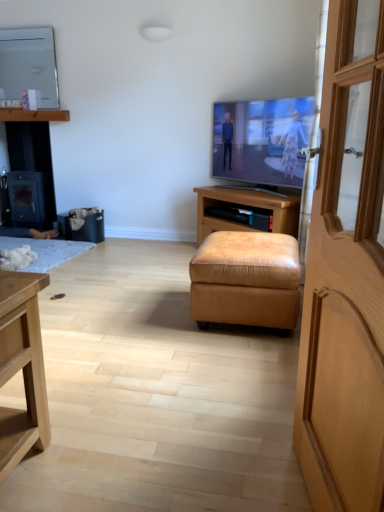
Locate an element on the screen. This screenshot has width=384, height=512. wooden door at right is located at coordinates (346, 275).

What is the approximate width of leather ottoman at center, which is counted as the second cabinetry, starting from the back?

It is 14.06 inches.

Describe the element at coordinates (30, 136) in the screenshot. I see `black matte wood fireplace at left` at that location.

Where is `black leather trash bin/can at lower left`? black leather trash bin/can at lower left is located at coordinates (82, 225).

In the image, there is a leather ottoman at center, acting as the 1th cabinetry starting from the right. Identify the location of plain below it (from the image's perspective). This screenshot has width=384, height=512. (46, 251).

Is white fluffy rug at lower left oriented away from leather ottoman at center, the 2th cabinetry when ordered from top to bottom?

No, white fluffy rug at lower left is not facing away from leather ottoman at center, the 2th cabinetry when ordered from top to bottom.

Is white fluffy rug at lower left with leather ottoman at center, positioned as the 1th cabinetry in front-to-back order?

They are not placed beside each other.

From a real-world perspective, does white fluffy rug at lower left sit lower than leather ottoman at center, placed as the second cabinetry when sorted from left to right?

Yes, from a real-world perspective, white fluffy rug at lower left is under leather ottoman at center, placed as the second cabinetry when sorted from left to right.

From the image's perspective, is flat screen tv at center, marked as the 2th television in a top-to-bottom arrangement, beneath white fluffy rug at lower left?

No, from the image's perspective, flat screen tv at center, marked as the 2th television in a top-to-bottom arrangement, is not beneath white fluffy rug at lower left.

Is white fluffy rug at lower left a part of flat screen tv at center, marked as the 2th television in a top-to-bottom arrangement?

No, white fluffy rug at lower left is not a part of flat screen tv at center, marked as the 2th television in a top-to-bottom arrangement.

Considering the positions of point (303, 127) and point (11, 241), is point (303, 127) closer or farther from the camera than point (11, 241)?

Point (303, 127) is positioned closer to the camera compared to point (11, 241).

Which object is positioned more to the right, flat screen tv at center, marked as the first television in a bottom-to-top arrangement, or tan leather ottoman at center?

flat screen tv at center, marked as the first television in a bottom-to-top arrangement, is more to the right.

How different are the orientations of flat screen tv at center, marked as the first television in a bottom-to-top arrangement, and tan leather ottoman at center in degrees?

48.8 degrees.

Who is smaller, flat screen tv at center, positioned as the 2th television in back-to-front order, or tan leather ottoman at center?

flat screen tv at center, positioned as the 2th television in back-to-front order.

Where is `stool to the left of flat screen tv at center, which is counted as the 1th television, starting from the front`? The width and height of the screenshot is (384, 512). stool to the left of flat screen tv at center, which is counted as the 1th television, starting from the front is located at coordinates (246, 280).

Is tan leather ottoman at center facing away from black leather trash bin/can at lower left?

tan leather ottoman at center is not turned away from black leather trash bin/can at lower left.

Between tan leather ottoman at center and black leather trash bin/can at lower left, which one has more height?

tan leather ottoman at center is taller.

Can you confirm if tan leather ottoman at center is smaller than black leather trash bin/can at lower left?

No.

Does tan leather ottoman at center lie in front of black leather trash bin/can at lower left?

Yes, it is in front of black leather trash bin/can at lower left.

Is wooden door at right wider than leather ottoman at center, placed as the second cabinetry when sorted from left to right?

Incorrect, the width of wooden door at right does not surpass that of leather ottoman at center, placed as the second cabinetry when sorted from left to right.

Who is bigger, wooden door at right or leather ottoman at center, positioned as the 1th cabinetry in front-to-back order?

leather ottoman at center, positioned as the 1th cabinetry in front-to-back order, is bigger.

Which of these two, wooden door at right or leather ottoman at center, acting as the 1th cabinetry starting from the right, stands shorter?

With less height is leather ottoman at center, acting as the 1th cabinetry starting from the right.

In the scene shown: Can you confirm if wooden door at right is positioned to the right of leather ottoman at center, the 2th cabinetry when ordered from top to bottom?

No.

From the picture: Which is behind, leather ottoman at center, the 2th cabinetry when ordered from top to bottom, or matte white mirror at upper left, which ranks as the first television in left-to-right order?

Positioned behind is matte white mirror at upper left, which ranks as the first television in left-to-right order.

Between leather ottoman at center, acting as the 1th cabinetry starting from the right, and matte white mirror at upper left, marked as the first television in a top-to-bottom arrangement, which one has smaller size?

matte white mirror at upper left, marked as the first television in a top-to-bottom arrangement, is smaller.

Which is more to the left, leather ottoman at center, which is counted as the second cabinetry, starting from the back, or matte white mirror at upper left, marked as the first television in a top-to-bottom arrangement?

From the viewer's perspective, matte white mirror at upper left, marked as the first television in a top-to-bottom arrangement, appears more on the left side.

Could you tell me if leather ottoman at center, which is counted as the first cabinetry, starting from the bottom, is facing white fluffy rug at lower left?

No, leather ottoman at center, which is counted as the first cabinetry, starting from the bottom, is not oriented towards white fluffy rug at lower left.

Can white fluffy rug at lower left be found inside leather ottoman at center, positioned as the 1th cabinetry in front-to-back order?

No, leather ottoman at center, positioned as the 1th cabinetry in front-to-back order, does not contain white fluffy rug at lower left.

Can you confirm if leather ottoman at center, placed as the second cabinetry when sorted from left to right, is shorter than white fluffy rug at lower left?

In fact, leather ottoman at center, placed as the second cabinetry when sorted from left to right, may be taller than white fluffy rug at lower left.

Considering the points (289, 221) and (18, 240), which point is in front, point (289, 221) or point (18, 240)?

The point (289, 221) is closer to the camera.

This screenshot has height=512, width=384. In order to click on plain on the left of leather ottoman at center, which is counted as the second cabinetry, starting from the back in this screenshot , I will do `click(46, 251)`.

The image size is (384, 512). I want to click on television on the right of the white fluffy rug at lower left, so [263, 140].

Which object lies further to the anchor point black leather trash bin/can at lower left, black matte wood fireplace at left or wooden door at right?

wooden door at right.

When comparing their distances from wooden door at right, does white fluffy rug at lower left or black leather trash bin/can at lower left seem closer?

white fluffy rug at lower left is closer to wooden door at right.

In the scene shown: From the image, which object appears to be nearer to black matte wood fireplace at left, matte white mirror at upper left, which ranks as the first television in left-to-right order, or tan leather ottoman at center?

matte white mirror at upper left, which ranks as the first television in left-to-right order, is closer to black matte wood fireplace at left.

From the image, which object appears to be farther from matte white mirror at upper left, arranged as the second television when viewed from the front, leather ottoman at center, which is counted as the second cabinetry, starting from the back, or black matte wood fireplace at left?

leather ottoman at center, which is counted as the second cabinetry, starting from the back.

Estimate the real-world distances between objects in this image. Which object is further from black matte wood fireplace at left, wooden shelf at upper left, which appears as the 1th cabinetry when viewed from the back, or flat screen tv at center, which is counted as the 1th television, starting from the front?

flat screen tv at center, which is counted as the 1th television, starting from the front, is positioned further to the anchor black matte wood fireplace at left.

Considering their positions, is wooden shelf at upper left, the 1th cabinetry when ordered from top to bottom, positioned further to wooden door at right than matte white mirror at upper left, which appears as the second television when viewed from the right?

The object further to wooden door at right is matte white mirror at upper left, which appears as the second television when viewed from the right.

When comparing their distances from black leather trash bin/can at lower left, does matte white mirror at upper left, marked as the first television in a top-to-bottom arrangement, or black matte wood fireplace at left seem further?

matte white mirror at upper left, marked as the first television in a top-to-bottom arrangement.

From the image, which object appears to be farther from leather ottoman at center, placed as the second cabinetry when sorted from left to right, flat screen tv at center, placed as the first television when sorted from right to left, or white fluffy rug at lower left?

Among the two, white fluffy rug at lower left is located further to leather ottoman at center, placed as the second cabinetry when sorted from left to right.

Where is `television between black matte wood fireplace at left and leather ottoman at center, positioned as the 1th cabinetry in front-to-back order`? television between black matte wood fireplace at left and leather ottoman at center, positioned as the 1th cabinetry in front-to-back order is located at coordinates (29, 64).

Where is `plain between black matte wood fireplace at left and leather ottoman at center, acting as the 1th cabinetry starting from the right, in the horizontal direction`? plain between black matte wood fireplace at left and leather ottoman at center, acting as the 1th cabinetry starting from the right, in the horizontal direction is located at coordinates (46, 251).

Where is `cabinetry between matte white mirror at upper left, arranged as the second television when viewed from the front, and leather ottoman at center, placed as the second cabinetry when sorted from left to right`? cabinetry between matte white mirror at upper left, arranged as the second television when viewed from the front, and leather ottoman at center, placed as the second cabinetry when sorted from left to right is located at coordinates (33, 115).

Locate an element on the screen. This screenshot has height=512, width=384. cabinetry between matte white mirror at upper left, which ranks as the 1th television in back-to-front order, and black matte wood fireplace at left in the up-down direction is located at coordinates (33, 115).